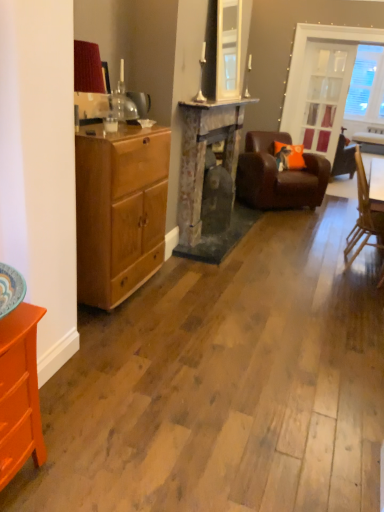
Question: In terms of width, does rustic stone fireplace at center look wider or thinner when compared to light brown wood cabinet at left?

Choices:
 (A) wide
 (B) thin

Answer: (B)

Question: Considering the positions of rustic stone fireplace at center and light brown wood cabinet at left in the image, is rustic stone fireplace at center taller or shorter than light brown wood cabinet at left?

Choices:
 (A) tall
 (B) short

Answer: (A)

Question: Estimate the real-world distances between objects in this image. Which object is farther from the orange fabric pillow at center?

Choices:
 (A) brown leather armchair at center, the 2th chair viewed from the front
 (B) clear glass door at upper right
 (C) wooden chair at right, arranged as the 2th chair when viewed from the back
 (D) orange painted wood dresser at lower left
 (E) clear glass door at upper right

Answer: (D)

Question: Which of these objects is positioned closest to the clear glass door at upper right?

Choices:
 (A) orange fabric pillow at center
 (B) clear glass door at upper right
 (C) rustic stone fireplace at center
 (D) brown leather armchair at center, arranged as the first chair when viewed from the back
 (E) wooden chair at right, arranged as the 2th chair when viewed from the back

Answer: (B)